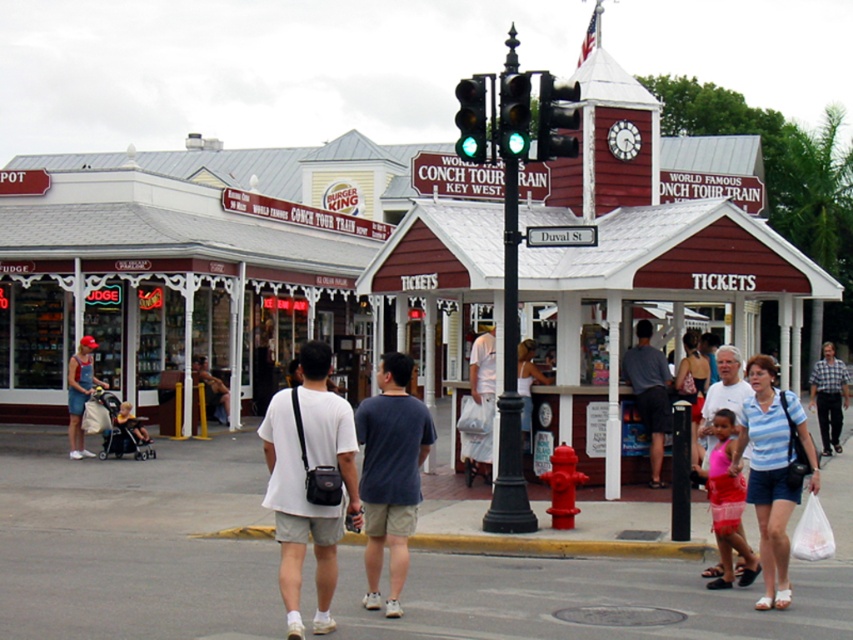
Question: Which point is closer to the camera taking this photo?

Choices:
 (A) (193, 356)
 (B) (643, 342)
 (C) (82, 435)

Answer: (B)

Question: Is pink fabric dress at lower right smaller than white cotton shirt at center?

Choices:
 (A) no
 (B) yes

Answer: (B)

Question: Can you confirm if dark blue t-shirt at center is positioned to the right of white cotton shirt at center?

Choices:
 (A) yes
 (B) no

Answer: (B)

Question: Which of these objects is positioned closest to the matte black shirt at center?

Choices:
 (A) dark gray shirt at center
 (B) white painted building at left

Answer: (B)

Question: Estimate the real-world distances between objects in this image. Which object is farther from the white matte bag at center?

Choices:
 (A) matte black shirt at center
 (B) dark gray shirt at center
 (C) dark blue t-shirt at center
 (D) blue striped shirt at center

Answer: (A)

Question: Can you confirm if pink fabric dress at lower right is positioned above denim shorts at left?

Choices:
 (A) no
 (B) yes

Answer: (A)